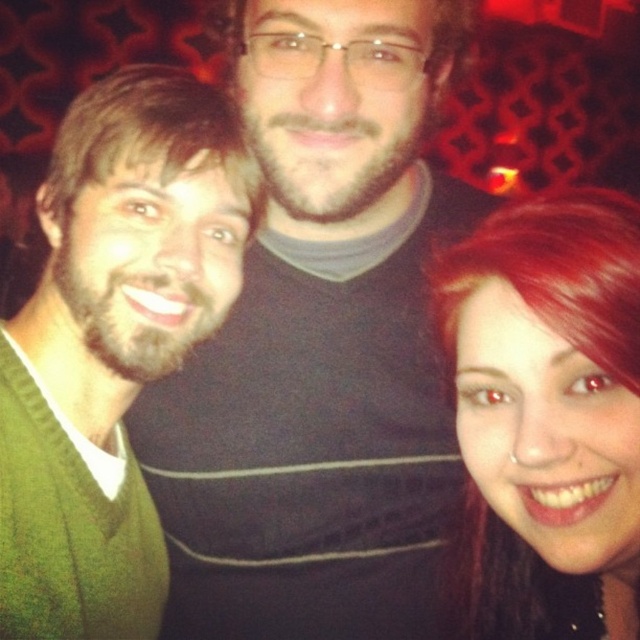
You are at a party and want to take a photo with the people in the image. You notice two distinctive features at the center of the image. Which one is positioned to the left when looking at the matte black shirt at center and the shiny red hair at center?

The matte black shirt at center is positioned to the left of the shiny red hair at center.